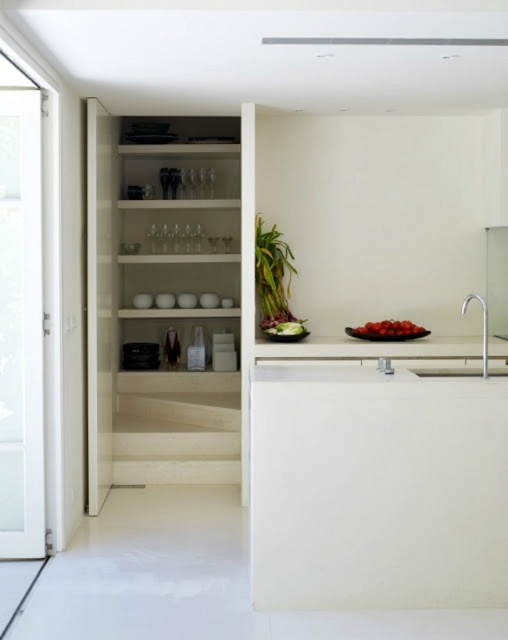
Who is more distant from viewer, (x=184, y=314) or (x=430, y=353)?

The point (x=184, y=314) is more distant.

Is white matte shelves at center shorter than white glossy countertop at center?

In fact, white matte shelves at center may be taller than white glossy countertop at center.

Does point (185, 276) come behind point (337, 358)?

Yes, point (185, 276) is farther from viewer.

You are a GUI agent. You are given a task and a screenshot of the screen. Output one action in this format:
    pyautogui.click(x=<x>, y=<y>)
    Task: Click on the white matte shelves at center
    
    Given the screenshot: What is the action you would take?
    point(169,305)

The height and width of the screenshot is (640, 508). I want to click on white matte shelves at center, so click(169, 305).

Does white matte shelves at center have a lesser height compared to satin nickel faucet at right?

In fact, white matte shelves at center may be taller than satin nickel faucet at right.

Identify the location of white matte shelves at center. (169, 305).

Consider the image. Is white glossy countertop at center shorter than satin nickel faucet at right?

Indeed, white glossy countertop at center has a lesser height compared to satin nickel faucet at right.

Which of these two, white glossy countertop at center or satin nickel faucet at right, stands shorter?

With less height is white glossy countertop at center.

This screenshot has height=640, width=508. Identify the location of white glossy countertop at center. (369, 348).